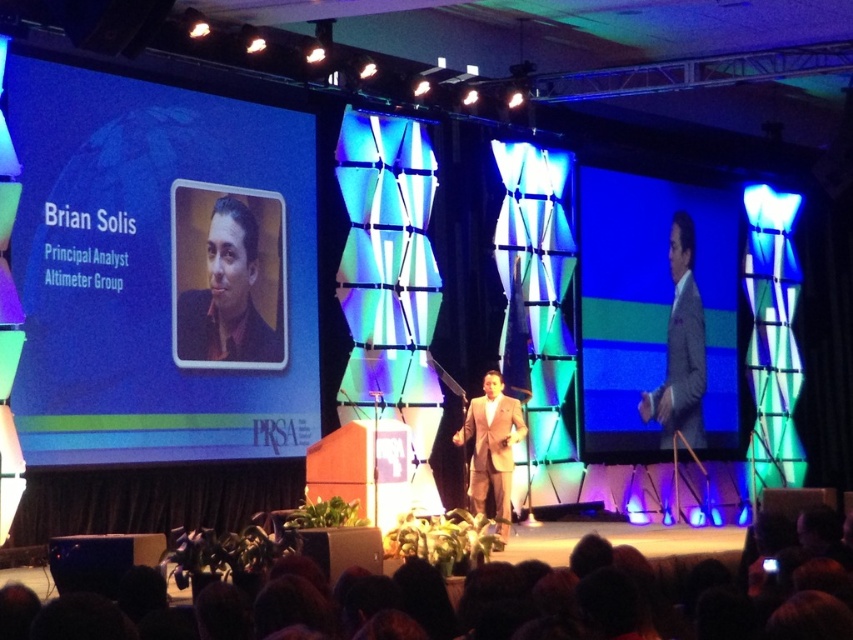
Which is more to the left, blue glossy projection screen at left or matte gray suit at center?

blue glossy projection screen at left is more to the left.

Is point (26, 333) positioned in front of point (700, 314)?

Yes, it is in front of point (700, 314).

Where is `blue glossy projection screen at left`? This screenshot has height=640, width=853. blue glossy projection screen at left is located at coordinates (161, 269).

Which is in front, point (74, 266) or point (625, 308)?

Point (74, 266) is in front.

Does blue glossy projection screen at left have a lesser width compared to matte gray suit at right?

Indeed, blue glossy projection screen at left has a lesser width compared to matte gray suit at right.

Image resolution: width=853 pixels, height=640 pixels. Identify the location of blue glossy projection screen at left. (161, 269).

I want to click on blue glossy projection screen at left, so click(161, 269).

Between matte black suit at center and tan fabric suit at center, which one appears on the right side from the viewer's perspective?

tan fabric suit at center

Which is above, matte black suit at center or tan fabric suit at center?

Positioned higher is matte black suit at center.

Is point (200, 301) positioned behind point (492, 390)?

Yes.

Identify the location of matte black suit at center. This screenshot has height=640, width=853. (227, 296).